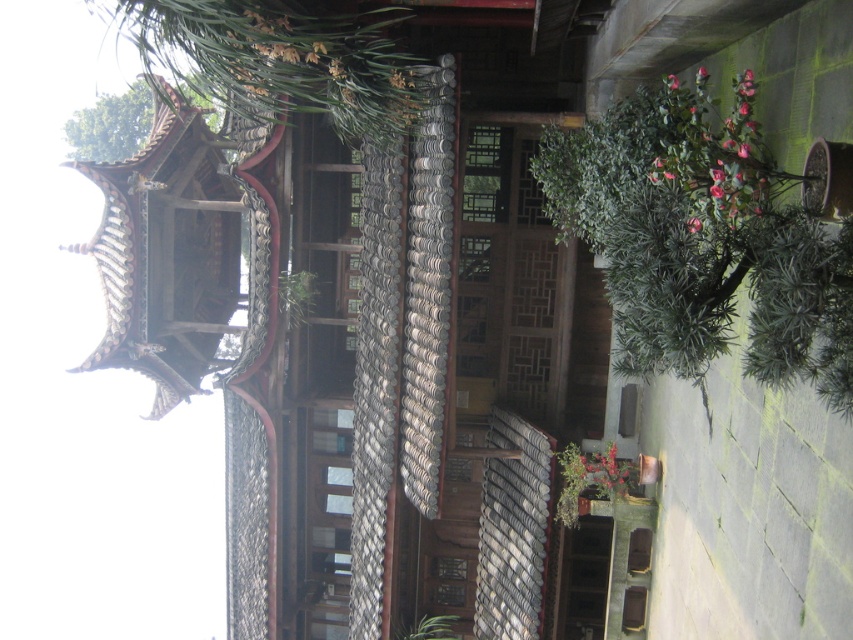
You are standing in front of the traditional Chinese pavilion. There is a point marked at coordinates (x=701, y=240) on the image. According to the scene description, what object is located at that point?

The point at coordinates (x=701, y=240) marks a green leafy plant at the right side of the structure.